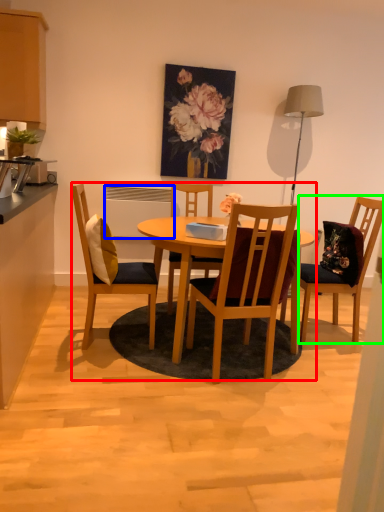
Question: Which object is positioned closest to kitchen & dining room table (highlighted by a red box)? Select from appliance (highlighted by a blue box) and chair (highlighted by a green box).

Choices:
 (A) appliance
 (B) chair

Answer: (A)